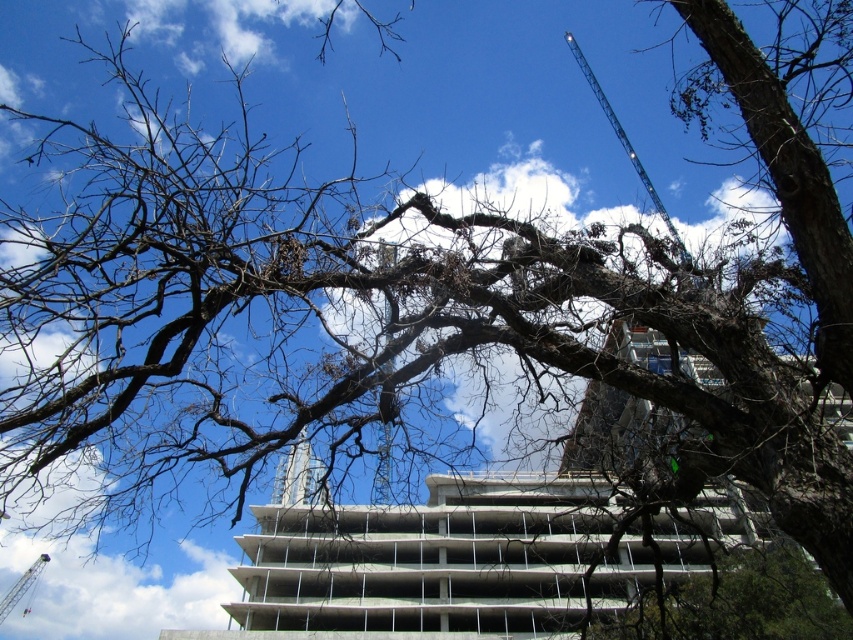
You are a construction worker standing at the base of the blue metallic crane at upper center. You need to move to the nearest emergency exit located at the lower left corner of the image. The emergency exit is 50 meters away from the crane. Can you safely walk directly to the exit without crossing any active construction zones? The construction zones are all located between the crane and the tree in the foreground.

The blue metallic crane at upper center is 44.23 meters from camera. The emergency exit is 50 meters away from the crane, so the total distance from your current position to the exit would be 44.23 meters plus 50 meters. However, the construction zones are between the crane and the tree, which is in the foreground. Since the emergency exit is at the lower left corner, which is likely outside the construction area, you can safely walk directly to the exit without crossing active zones as long as you avoidthe

Based on the photo, you are a construction worker standing at the base of the metallic blue crane at lower left. You need to move towards the white concrete tower at center. Which direction should you walk to reach it?

The white concrete tower at center is to the right of the metallic blue crane at lower left, so you should walk to the right to reach it.